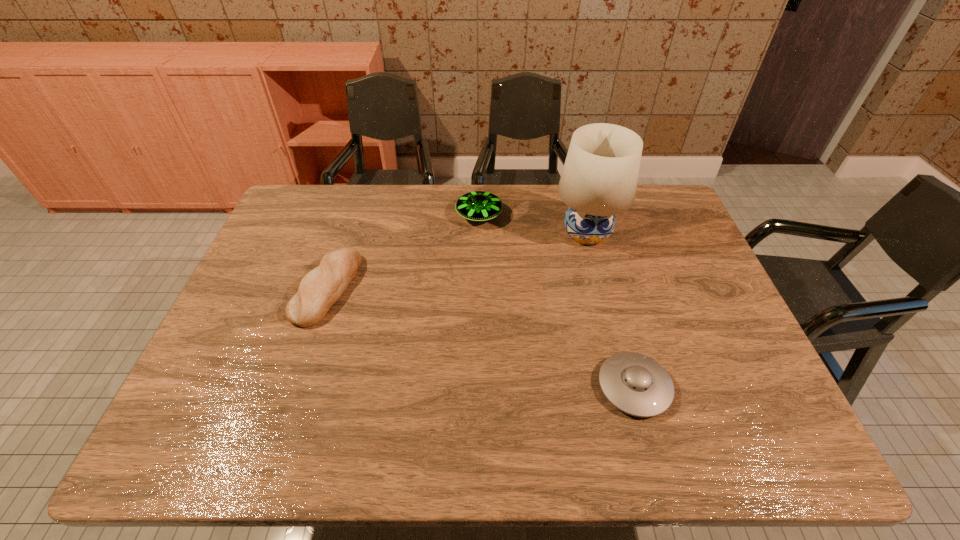
Find the location of `vacant space situated on the back of the nearest object`. vacant space situated on the back of the nearest object is located at coordinates (609, 293).

Identify the location of lampshade that is at the far edge. This screenshot has height=540, width=960. (599, 179).

This screenshot has height=540, width=960. What are the coordinates of `saucer present at the far edge` in the screenshot? It's located at (478, 206).

Identify the location of object that is at the near edge. (636, 384).

The width and height of the screenshot is (960, 540). I want to click on object that is at the left edge, so click(x=320, y=289).

The height and width of the screenshot is (540, 960). I want to click on free space at the near edge of the desktop, so click(336, 441).

At what (x,y) coordinates should I click in order to perform the action: click on vacant area at the left edge. Please return your answer as a coordinate pair (x, y). Looking at the image, I should click on (277, 285).

This screenshot has width=960, height=540. In the image, there is a desktop. In order to click on blank space at the right edge in this screenshot , I will do `click(655, 241)`.

The width and height of the screenshot is (960, 540). I want to click on blank area at the far right corner, so click(x=643, y=216).

Identify the location of free space that is in between the leftmost object and the left saucer. The height and width of the screenshot is (540, 960). (403, 252).